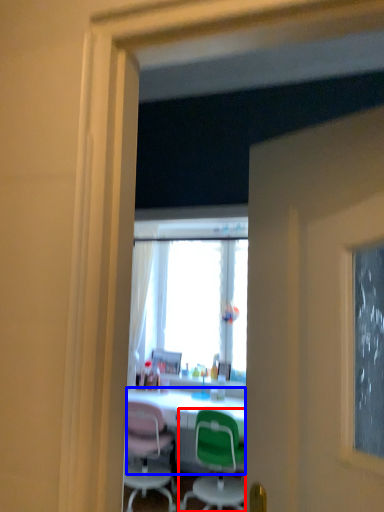
Question: Which object is further to the camera taking this photo, chair (highlighted by a red box) or desk (highlighted by a blue box)?

Choices:
 (A) chair
 (B) desk

Answer: (B)